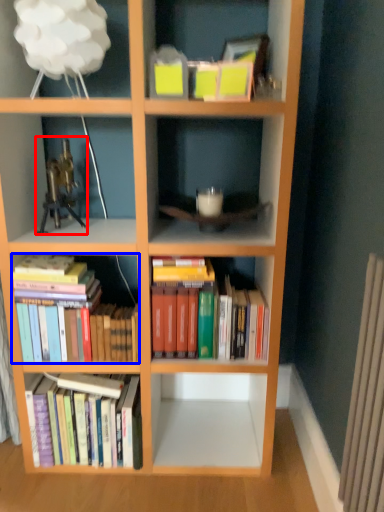
Question: Which object appears closest to the camera in this image, toy (highlighted by a red box) or book (highlighted by a blue box)?

Choices:
 (A) toy
 (B) book

Answer: (A)